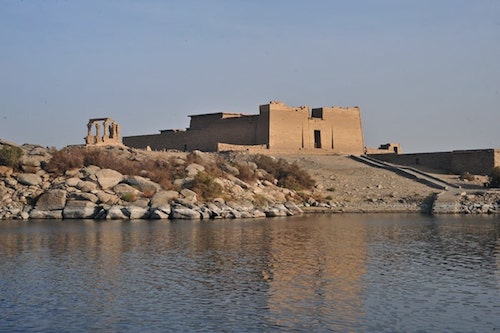
Where is `stairs`? This screenshot has height=333, width=500. stairs is located at coordinates (423, 177), (376, 162).